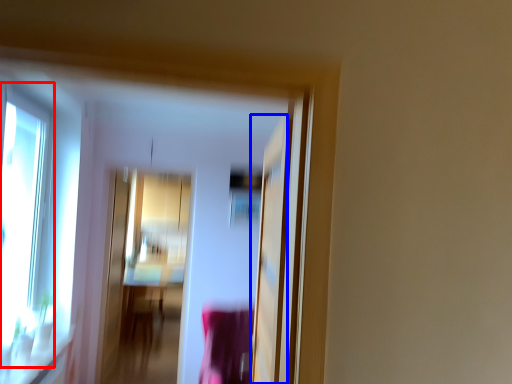
Question: Among these objects, which one is farthest to the camera, window (highlighted by a red box) or screen door (highlighted by a blue box)?

Choices:
 (A) window
 (B) screen door

Answer: (A)